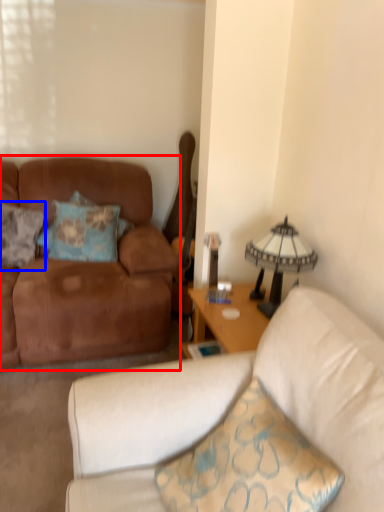
Question: Which object is closer to the camera taking this photo, studio couch (highlighted by a red box) or pillow (highlighted by a blue box)?

Choices:
 (A) studio couch
 (B) pillow

Answer: (A)